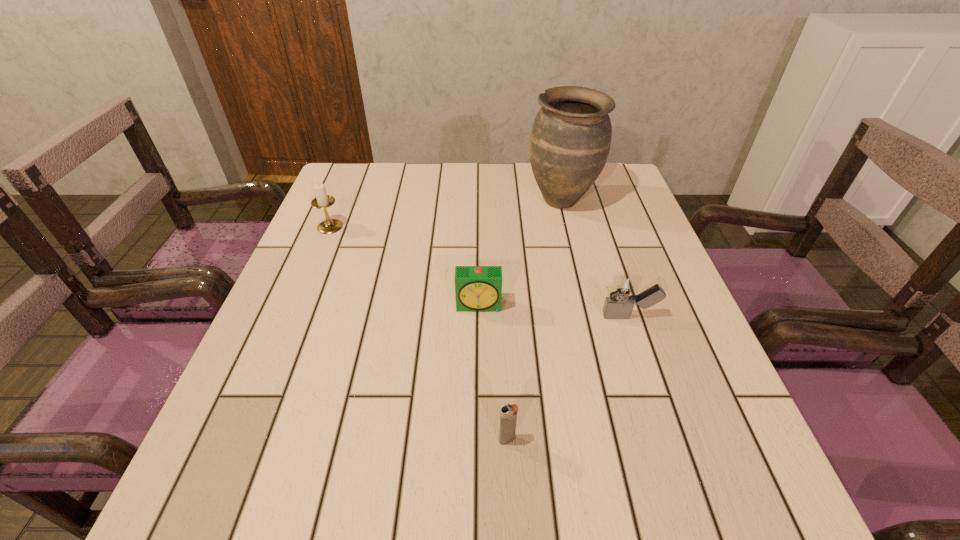
At what (x,y) coordinates should I click in order to perform the action: click on vacant space at the right edge of the desktop. Please return your answer as a coordinate pair (x, y). The height and width of the screenshot is (540, 960). Looking at the image, I should click on pyautogui.click(x=649, y=276).

Locate an element on the screen. The width and height of the screenshot is (960, 540). vacant space at the far left corner of the desktop is located at coordinates (359, 188).

Image resolution: width=960 pixels, height=540 pixels. I want to click on free space at the far right corner of the desktop, so click(x=598, y=182).

Image resolution: width=960 pixels, height=540 pixels. Identify the location of free spot between the shorter igniter and the candle holder. (419, 333).

The width and height of the screenshot is (960, 540). Identify the location of unoccupied position between the alarm clock and the nearest object. (493, 373).

This screenshot has height=540, width=960. In order to click on unoccupied area between the right igniter and the urn in this screenshot , I will do `click(595, 258)`.

Locate an element on the screen. vacant space in between the nearest object and the alarm clock is located at coordinates (493, 373).

Locate an element on the screen. Image resolution: width=960 pixels, height=540 pixels. free space between the leftmost object and the left igniter is located at coordinates (419, 333).

Find the location of a particular element. unoccupied area between the alarm clock and the leftmost object is located at coordinates (405, 266).

Identify the location of empty location between the alarm clock and the farther igniter. The image size is (960, 540). (555, 311).